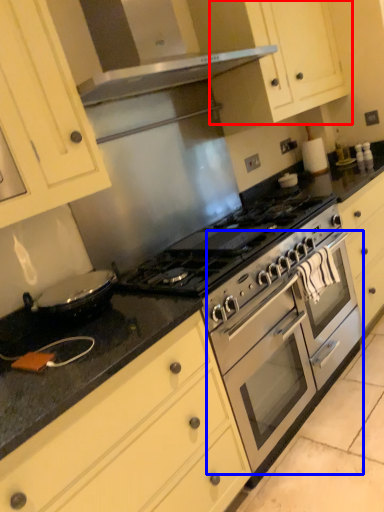
Question: Among these objects, which one is farthest to the camera, cabinetry (highlighted by a red box) or oven (highlighted by a blue box)?

Choices:
 (A) cabinetry
 (B) oven

Answer: (A)